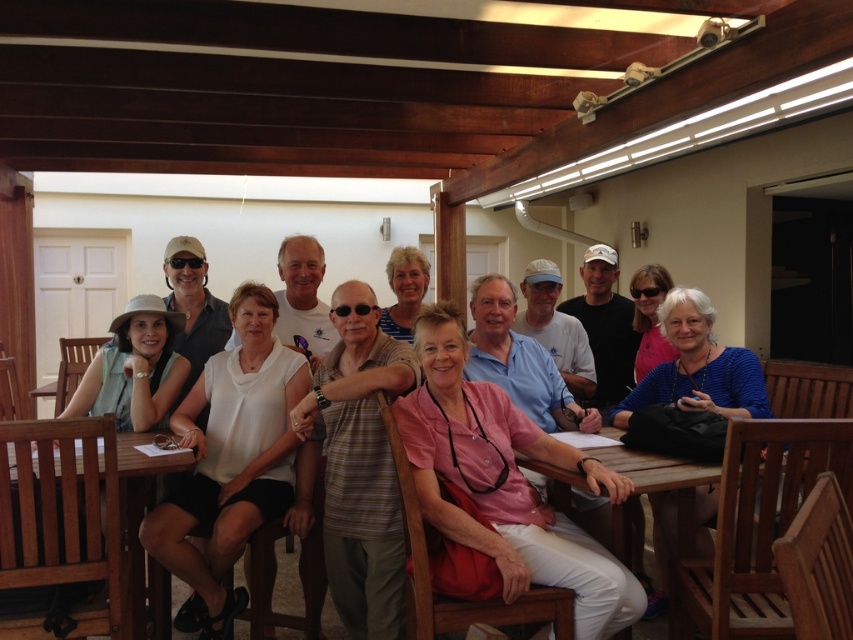
Is teak wood table at lower left shorter than wooden table at center?

In fact, teak wood table at lower left may be taller than wooden table at center.

Is teak wood table at lower left positioned at the back of wooden table at center?

No.

Where is `teak wood table at lower left`? teak wood table at lower left is located at coordinates (67, 516).